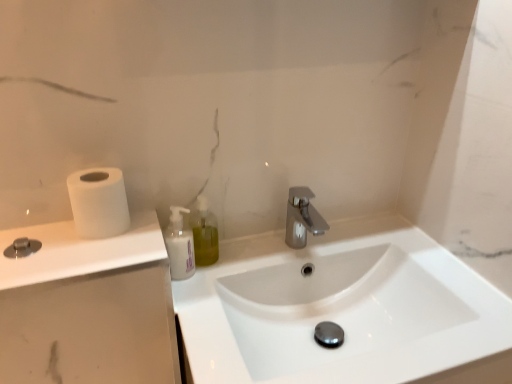
Where is `spots to the right of white matte bottle at center`? Image resolution: width=512 pixels, height=384 pixels. spots to the right of white matte bottle at center is located at coordinates (234, 259).